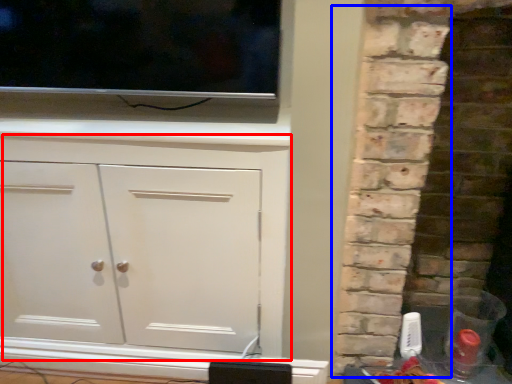
Question: Which object appears farthest to the camera in this image, cupboard (highlighted by a red box) or brickwork (highlighted by a blue box)?

Choices:
 (A) cupboard
 (B) brickwork

Answer: (A)